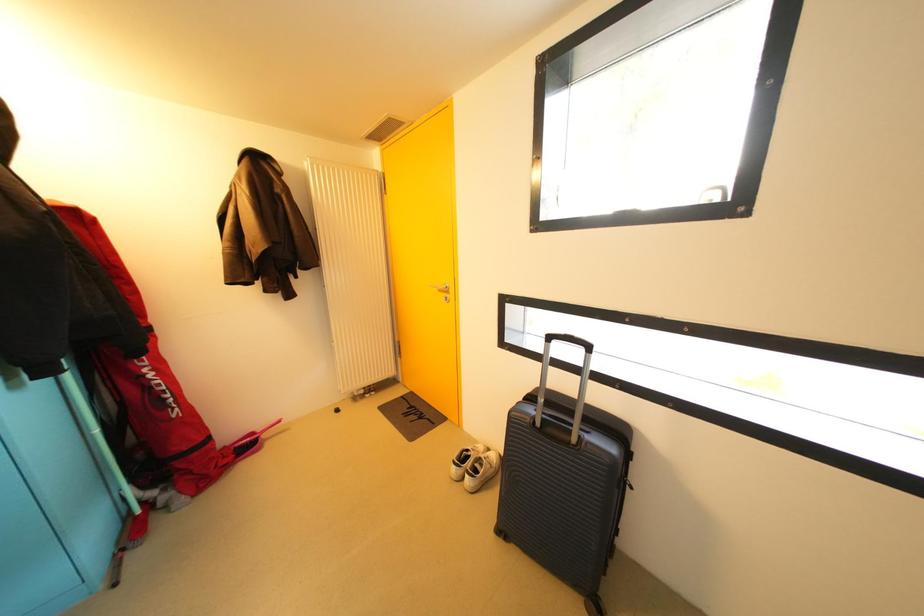
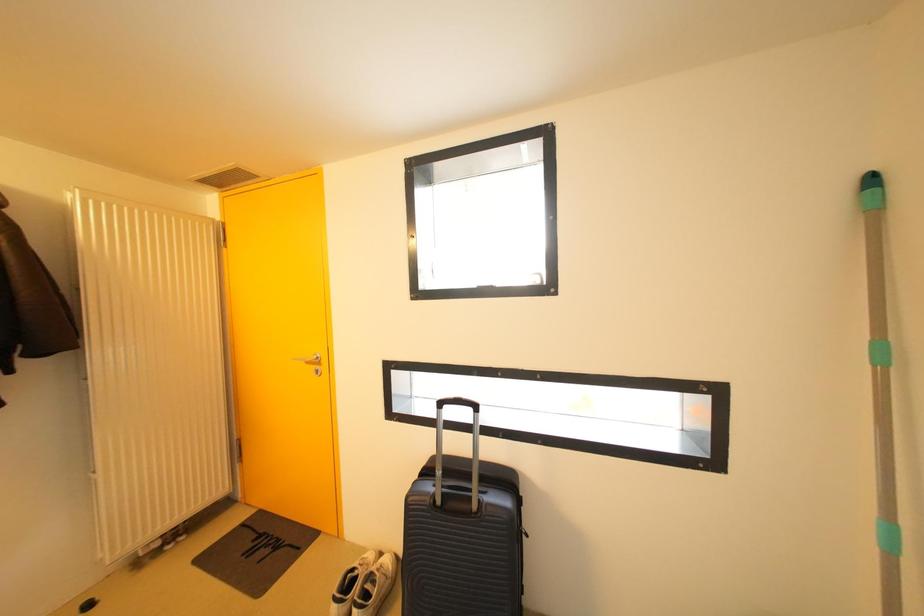
Question: The camera is either moving clockwise (left) or counter-clockwise (right) around the object. The first image is from the beginning of the video and the second image is from the end. Is the camera moving left or right when shooting the video?

Choices:
 (A) Left
 (B) Right

Answer: (A)